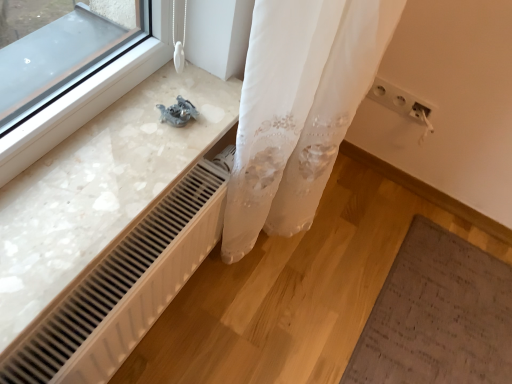
At what (x,y) coordinates should I click in order to perform the action: click on free point above white plastic radiator at lower center (from a real-world perspective). Please return your answer as a coordinate pair (x, y). Looking at the image, I should click on (105, 263).